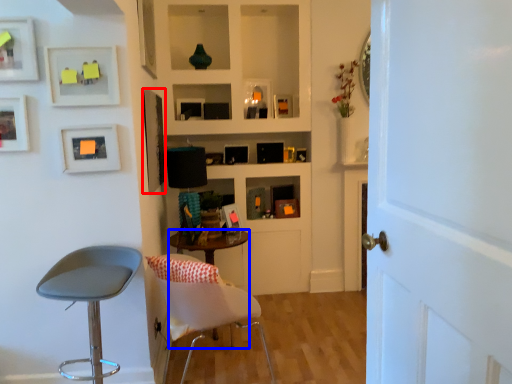
Question: Which point is further to the camera, picture frame (highlighted by a red box) or desk (highlighted by a blue box)?

Choices:
 (A) picture frame
 (B) desk

Answer: (A)